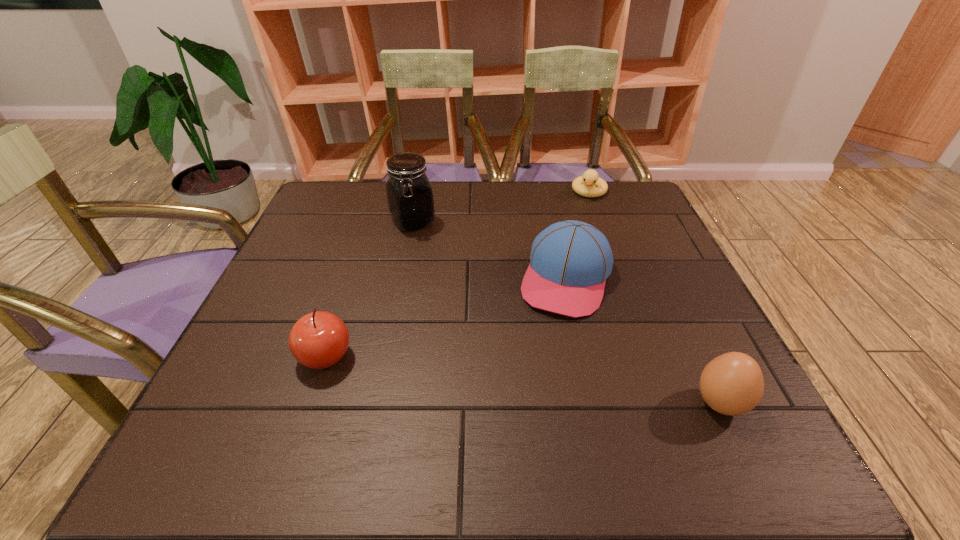
Where is `vacant space that is in between the fourth farthest object and the baseball cap`? This screenshot has width=960, height=540. vacant space that is in between the fourth farthest object and the baseball cap is located at coordinates (445, 318).

This screenshot has width=960, height=540. Find the location of `vacant space that's between the fourth nearest object and the third nearest object`. vacant space that's between the fourth nearest object and the third nearest object is located at coordinates (490, 251).

Locate an element on the screen. This screenshot has height=540, width=960. free spot between the apple and the baseball cap is located at coordinates pyautogui.click(x=445, y=318).

Where is `the fourth closest object to the nearest object`? Image resolution: width=960 pixels, height=540 pixels. the fourth closest object to the nearest object is located at coordinates (410, 199).

You are a GUI agent. You are given a task and a screenshot of the screen. Output one action in this format:
    pyautogui.click(x=<x>, y=<y>)
    Task: Click on the object that is the fourth nearest to the nearest object
    This screenshot has width=960, height=540.
    Given the screenshot: What is the action you would take?
    pyautogui.click(x=410, y=199)

Identify the location of free space that satisfies the following two spatial constraints: 1. on the front side of the baseball cap; 2. on the right side of the boiled egg. The height and width of the screenshot is (540, 960). click(593, 403).

You are a GUI agent. You are given a task and a screenshot of the screen. Output one action in this format:
    pyautogui.click(x=<x>, y=<y>)
    Task: Click on the blank area in the image that satisfies the following two spatial constraints: 1. on the front side of the jar; 2. on the left side of the baseball cap
    This screenshot has height=540, width=960.
    Given the screenshot: What is the action you would take?
    pyautogui.click(x=401, y=279)

In order to click on free space that satisfies the following two spatial constraints: 1. on the front side of the jar; 2. on the left side of the nearest object in this screenshot , I will do `click(375, 403)`.